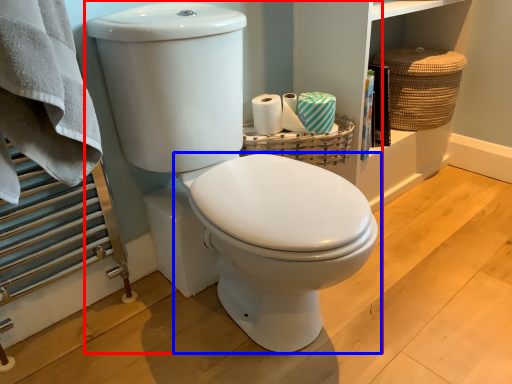
Question: Among these objects, which one is farthest to the camera, toilet (highlighted by a red box) or toilet (highlighted by a blue box)?

Choices:
 (A) toilet
 (B) toilet

Answer: (B)